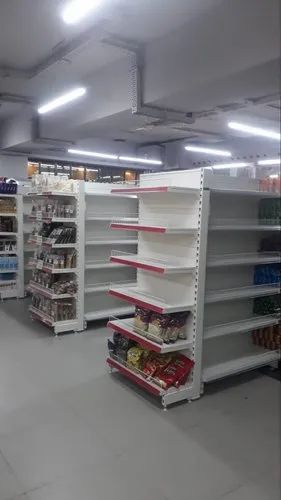
Find the location of a particular element. white tiled floor is located at coordinates (55, 442).